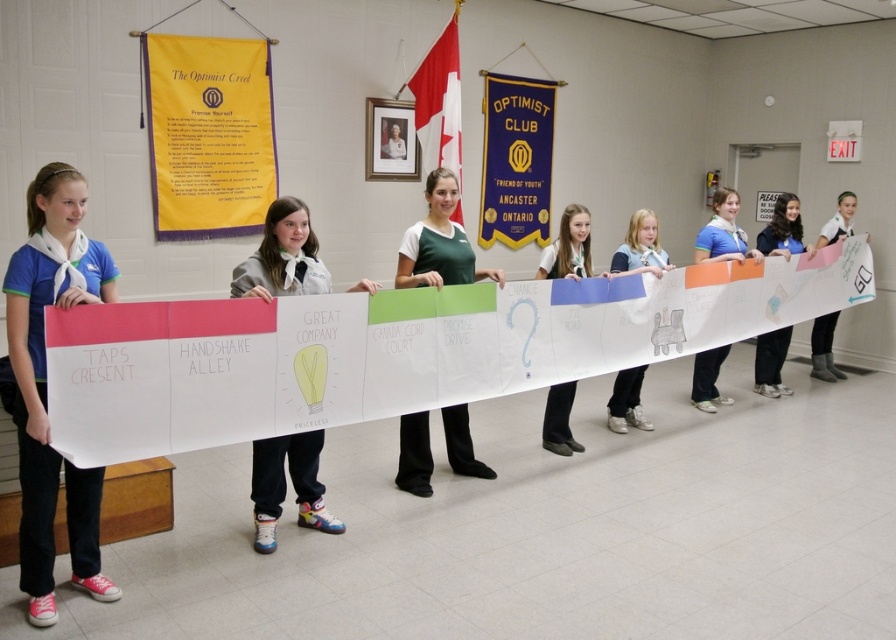
Who is lower down, white paper banner at center or white glossy banner at center?

Positioned lower is white paper banner at center.

This screenshot has height=640, width=896. Describe the element at coordinates (397, 348) in the screenshot. I see `white paper banner at center` at that location.

Is point (118, 320) farther from camera compared to point (556, 257)?

No, it is in front of (556, 257).

The height and width of the screenshot is (640, 896). I want to click on white paper banner at center, so click(397, 348).

What do you see at coordinates (567, 248) in the screenshot? I see `white glossy banner at center` at bounding box center [567, 248].

Identify the location of white glossy banner at center. The width and height of the screenshot is (896, 640). (567, 248).

The width and height of the screenshot is (896, 640). Describe the element at coordinates (567, 248) in the screenshot. I see `white glossy banner at center` at that location.

Identify the location of white glossy banner at center. Image resolution: width=896 pixels, height=640 pixels. (567, 248).

Is point (210, 403) positioned before point (634, 243)?

Yes, it is.

Can you confirm if white paper banner at center is positioned above matte white banner at center?

Incorrect, white paper banner at center is not positioned above matte white banner at center.

What are the coordinates of `white paper banner at center` in the screenshot? It's located at (397, 348).

Find the location of a particular element. Image resolution: width=896 pixels, height=640 pixels. white paper banner at center is located at coordinates (397, 348).